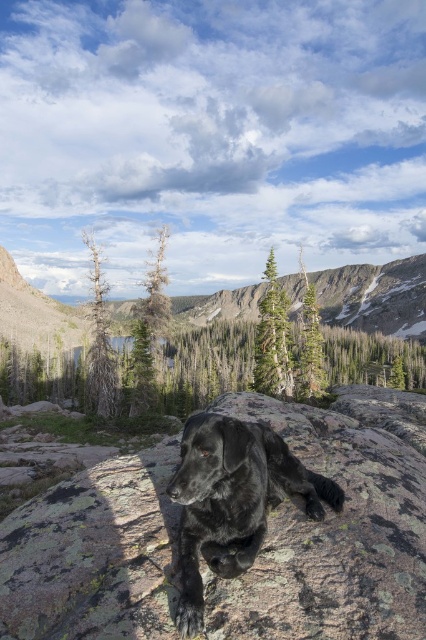
Question: Does rough granite boulder at center have a lesser width compared to shiny black dog at center?

Choices:
 (A) yes
 (B) no

Answer: (B)

Question: Which object is farther from the camera taking this photo?

Choices:
 (A) shiny black dog at center
 (B) rough granite boulder at center

Answer: (A)

Question: Which of the following is the closest to the observer?

Choices:
 (A) click(x=124, y=508)
 (B) click(x=229, y=417)

Answer: (B)

Question: Where is rough granite boulder at center located in relation to shiny black dog at center in the image?

Choices:
 (A) left
 (B) right

Answer: (B)

Question: Is rough granite boulder at center to the right of shiny black dog at center from the viewer's perspective?

Choices:
 (A) yes
 (B) no

Answer: (A)